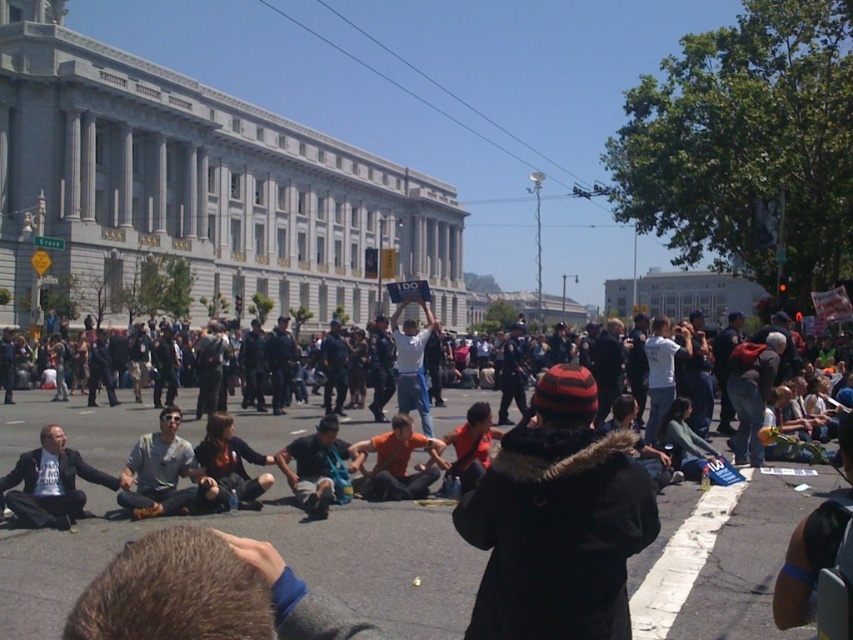
Question: Can you confirm if light gray suit at lower left is positioned above orange cotton shirt at center?

Choices:
 (A) yes
 (B) no

Answer: (B)

Question: Is blue denim jeans at center below orange fabric shirt at center?

Choices:
 (A) no
 (B) yes

Answer: (B)

Question: Does orange shirt at center appear on the left side of orange fabric shirt at center?

Choices:
 (A) yes
 (B) no

Answer: (A)

Question: Among these points, which one is farthest from the camera?

Choices:
 (A) (630, 435)
 (B) (250, 448)

Answer: (B)

Question: Among these points, which one is nearest to the camera?

Choices:
 (A) (430, 321)
 (B) (399, 492)

Answer: (B)

Question: Which object is farther from the camera taking this photo?

Choices:
 (A) orange fabric shirt at center
 (B) blue denim jeans at center

Answer: (A)